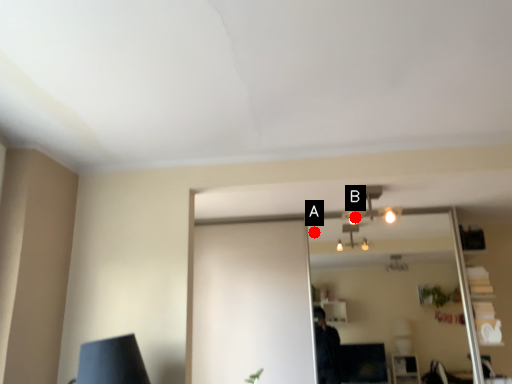
Question: Two points are circled on the image, labeled by A and B beside each circle. Which point is closer to the camera?

Choices:
 (A) A is closer
 (B) B is closer

Answer: (B)